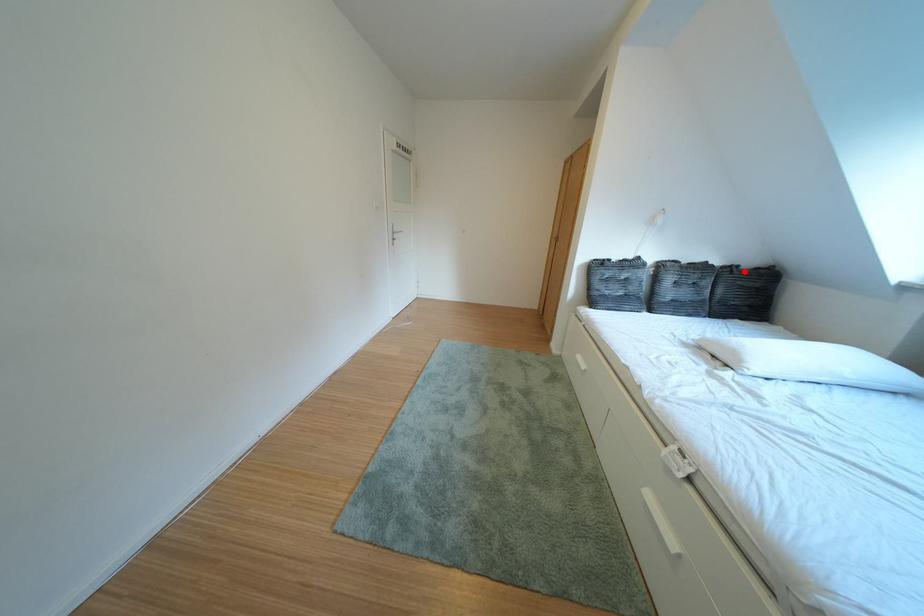
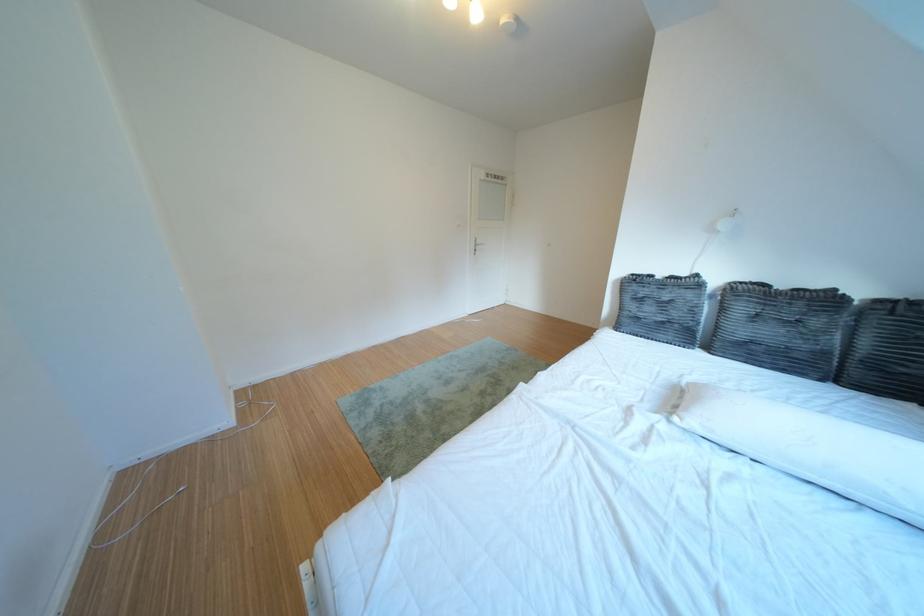
In the second image, find the point that corresponds to the highlighted location in the first image.

(910, 306)